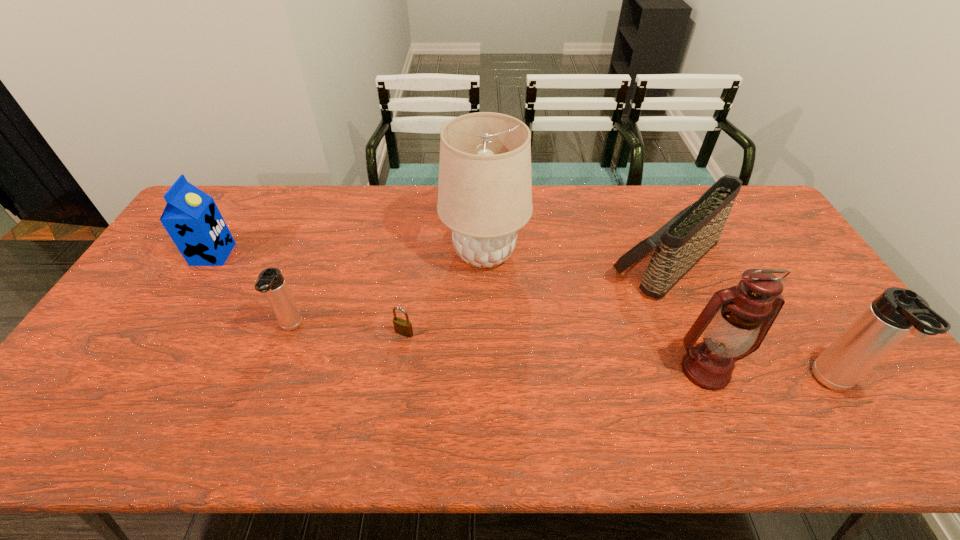
Please determine a free point for an extra thermos_bottle to ensure balance. Please provide its 2D coordinates. Your answer should be formatted as a tuple, i.e. [(x, y)], where the tuple contains the x and y coordinates of a point satisfying the conditions above.

[(548, 355)]